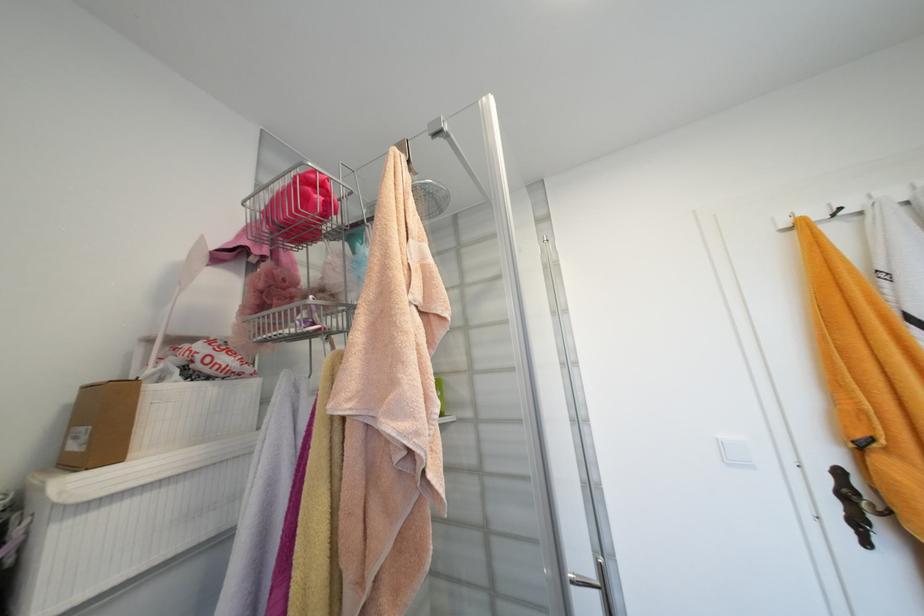
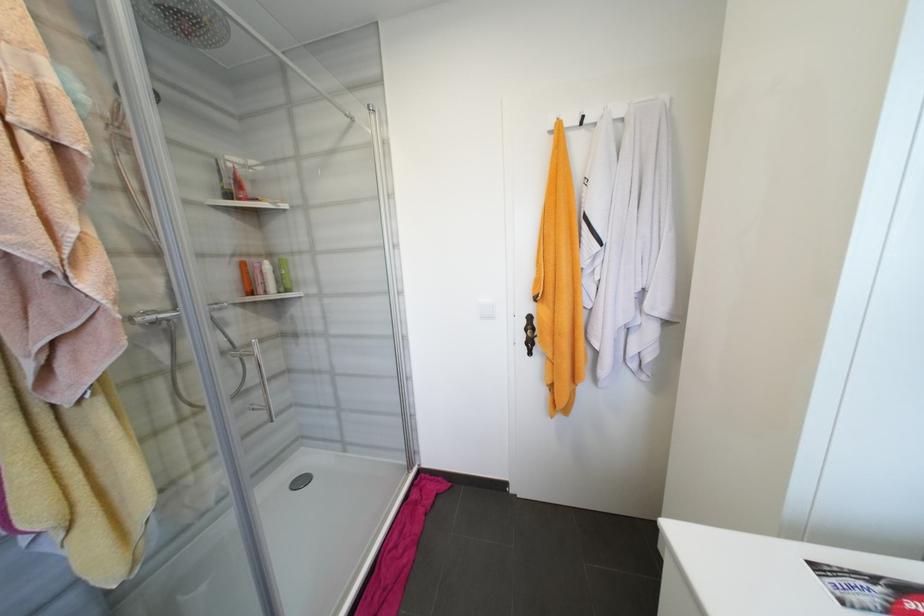
Question: The first image is from the beginning of the video and the second image is from the end. How did the camera likely rotate when shooting the video?

Choices:
 (A) Left
 (B) Right
 (C) Up
 (D) Down

Answer: (D)